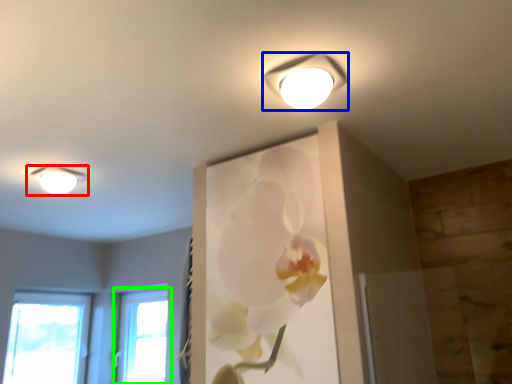
Question: Based on their relative distances, which object is nearer to lamp (highlighted by a red box)? Choose from lamp (highlighted by a blue box) and window (highlighted by a green box).

Choices:
 (A) lamp
 (B) window

Answer: (A)